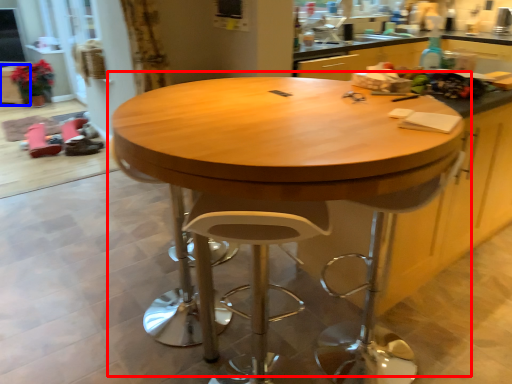
Question: Which point is further to the camera, table (highlighted by a red box) or cabinetry (highlighted by a blue box)?

Choices:
 (A) table
 (B) cabinetry

Answer: (B)